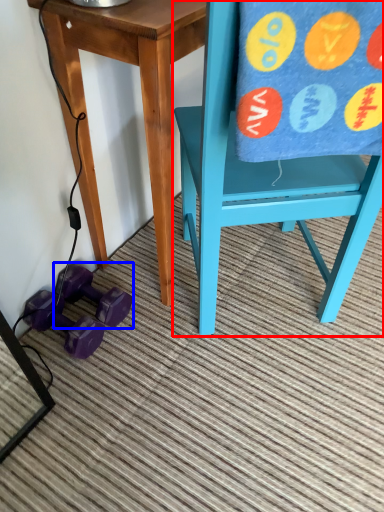
Question: Which object is closer to the camera taking this photo, chair (highlighted by a red box) or dumbbell (highlighted by a blue box)?

Choices:
 (A) chair
 (B) dumbbell

Answer: (A)